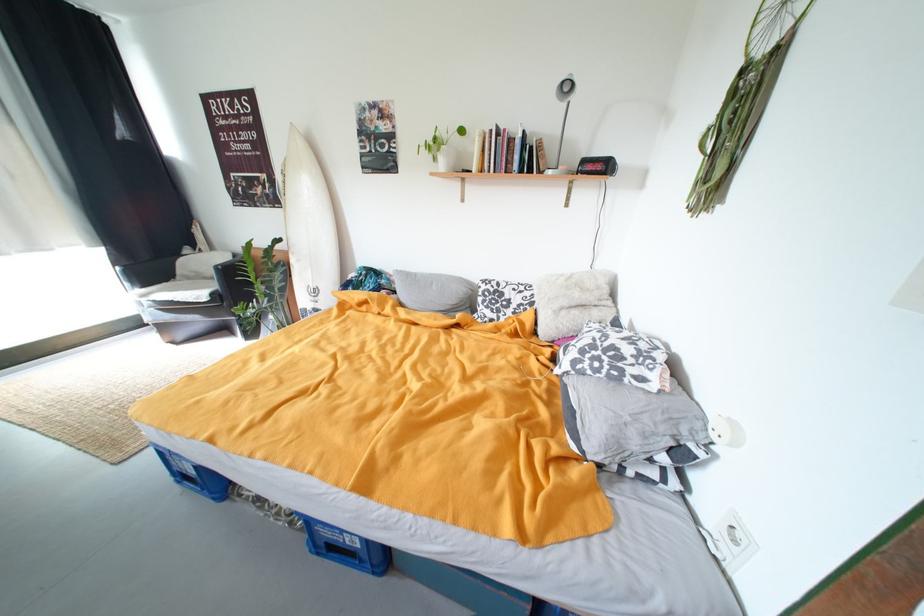
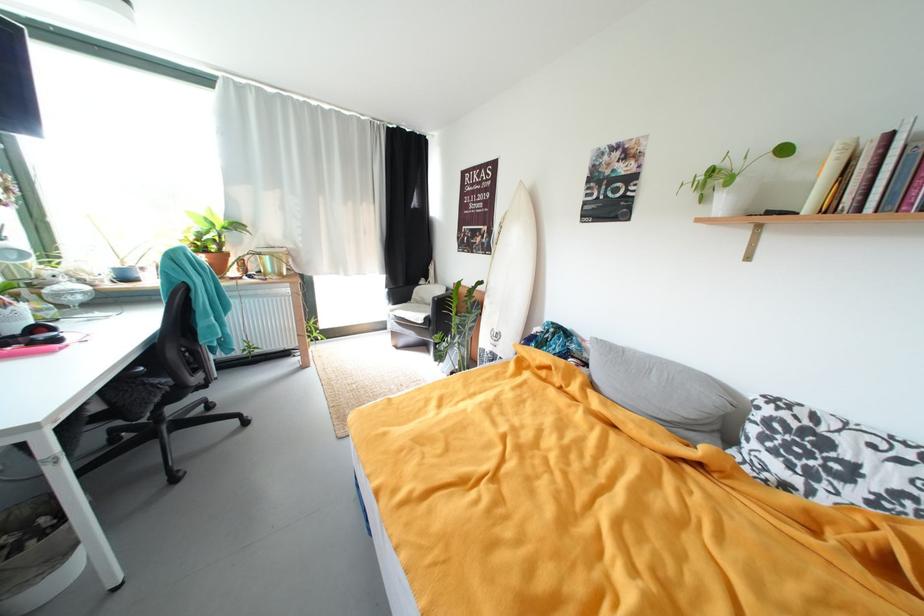
Find the pixel in the second image that matches point 450,166 in the first image.

(730, 206)